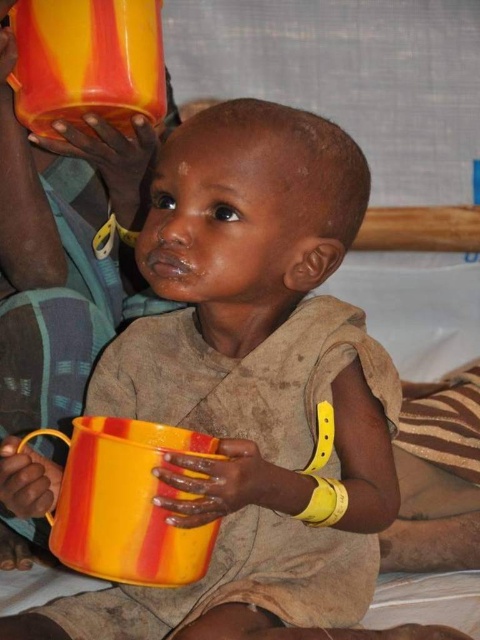
Can you confirm if yellow striped mug at center is smaller than yellow/red striped cup at upper left?

Actually, yellow striped mug at center might be larger than yellow/red striped cup at upper left.

This screenshot has height=640, width=480. In order to click on yellow striped mug at center in this screenshot , I will do `click(124, 502)`.

The height and width of the screenshot is (640, 480). I want to click on yellow striped mug at center, so click(124, 502).